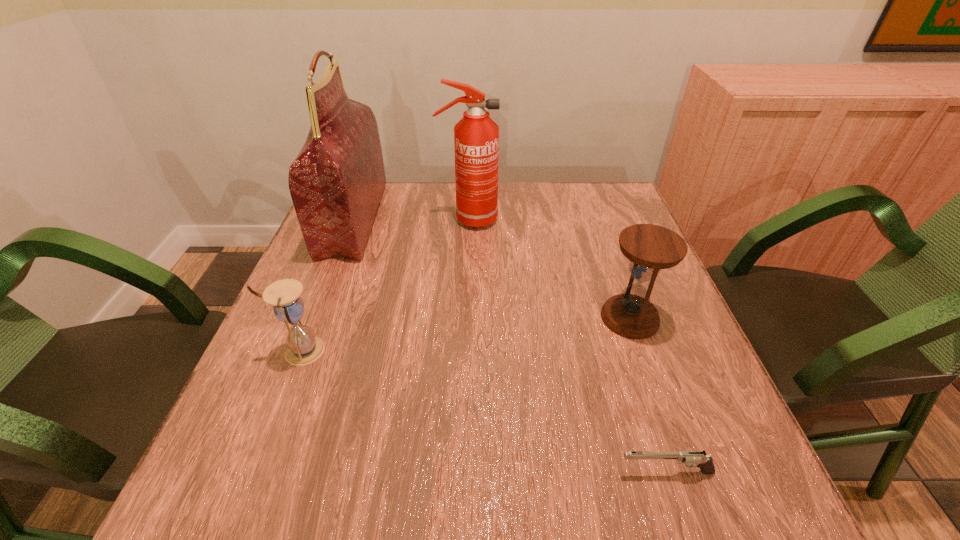
This screenshot has width=960, height=540. Identify the location of pistol situated at the right edge. (698, 459).

Where is `object situated at the far left corner`? object situated at the far left corner is located at coordinates coord(336,182).

Find the location of a particular element. This screenshot has height=540, width=960. object that is at the near right corner is located at coordinates (698, 459).

You are a GUI agent. You are given a task and a screenshot of the screen. Output one action in this format:
    pyautogui.click(x=<x>, y=<y>)
    Task: Click on the vacant space at the far edge
    
    Given the screenshot: What is the action you would take?
    pyautogui.click(x=441, y=210)

Locate an element on the screen. The height and width of the screenshot is (540, 960). vacant region at the near edge of the desktop is located at coordinates (329, 485).

I want to click on vacant space at the left edge of the desktop, so click(260, 423).

Image resolution: width=960 pixels, height=540 pixels. Find the location of `free space at the right edge of the desktop`. free space at the right edge of the desktop is located at coordinates (680, 411).

Identify the location of vacant space at the far left corner of the desktop. (385, 194).

At what (x,y) coordinates should I click in order to perform the action: click on free space at the far right corner. Please return your answer as a coordinate pair (x, y). The height and width of the screenshot is (540, 960). Looking at the image, I should click on (610, 210).

Locate an element on the screen. vacant region at the near right corner of the desktop is located at coordinates (730, 467).